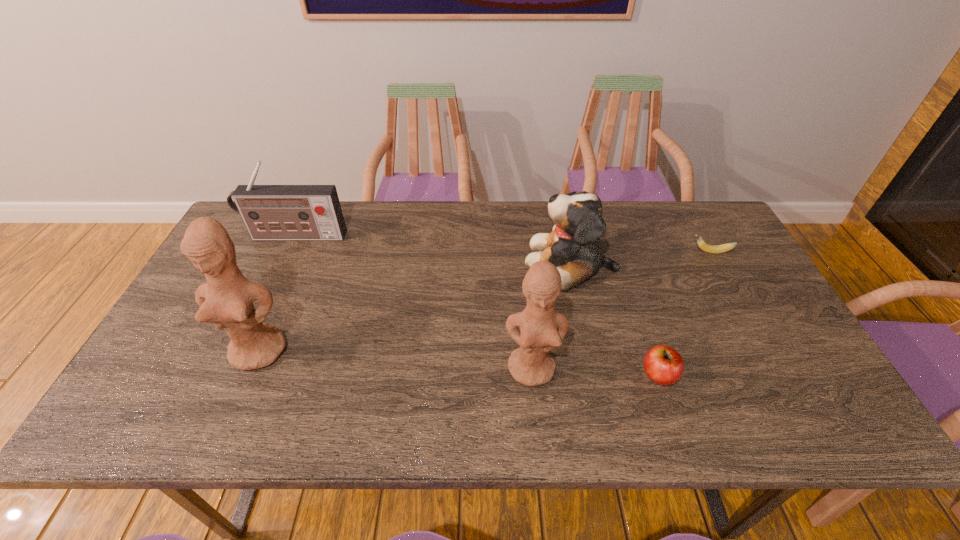
Image resolution: width=960 pixels, height=540 pixels. Find the location of `vacant place for an extra figurine on the right`. vacant place for an extra figurine on the right is located at coordinates (825, 387).